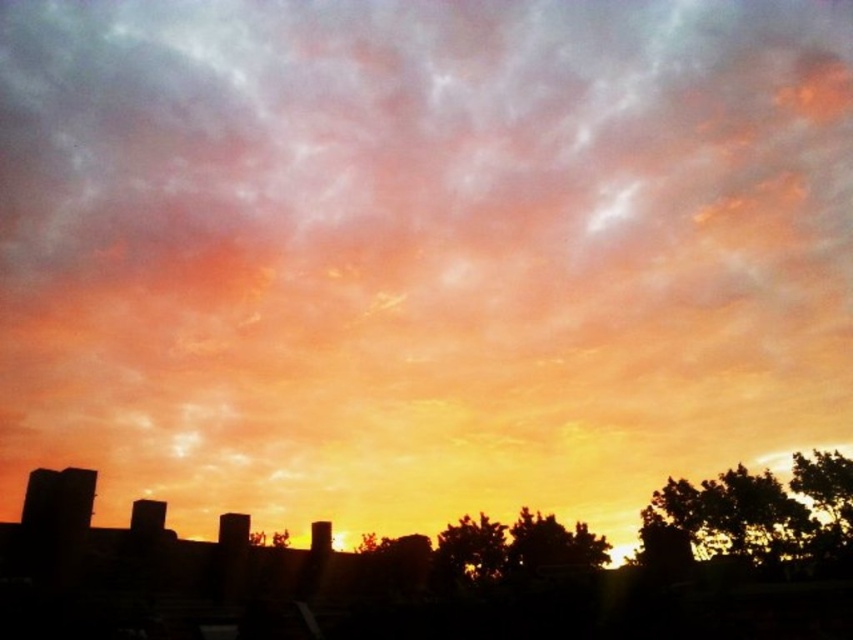
Can you confirm if dark green leafy tree at lower right is taller than green leafy tree at center?

Yes, dark green leafy tree at lower right is taller than green leafy tree at center.

Does dark green leafy tree at lower right appear over green leafy tree at center?

Correct, dark green leafy tree at lower right is located above green leafy tree at center.

Is point (769, 513) positioned in front of point (440, 568)?

No, it is not.

Where is `dark green leafy tree at lower right`? dark green leafy tree at lower right is located at coordinates (730, 515).

Does green leafy tree at center have a larger size compared to green leafy tree at lower right?

Yes, green leafy tree at center is bigger than green leafy tree at lower right.

Can you confirm if green leafy tree at center is positioned below green leafy tree at lower right?

Indeed, green leafy tree at center is positioned under green leafy tree at lower right.

Is point (495, 556) farther from viewer compared to point (811, 486)?

Yes, it is behind point (811, 486).

In order to click on green leafy tree at center in this screenshot , I will do point(469,552).

Does dark green leafy tree at lower right come behind green leafy tree at lower right?

No, it is not.

Is the position of dark green leafy tree at lower right less distant than that of green leafy tree at lower right?

Yes, it is in front of green leafy tree at lower right.

The image size is (853, 640). Identify the location of dark green leafy tree at lower right. (x=730, y=515).